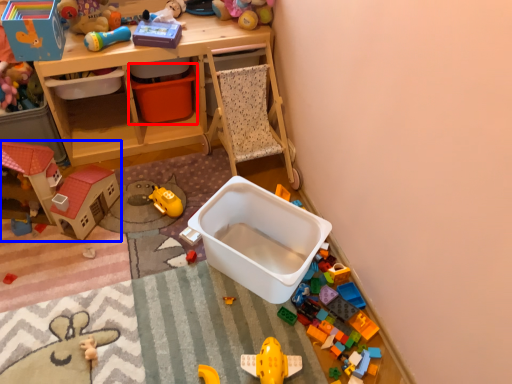
Question: Which point is further to the camera, storage box (highlighted by a red box) or toy (highlighted by a blue box)?

Choices:
 (A) storage box
 (B) toy

Answer: (A)